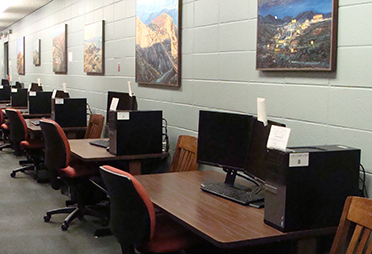
This screenshot has width=372, height=254. Find the location of `chair`. chair is located at coordinates (175, 154), (348, 216).